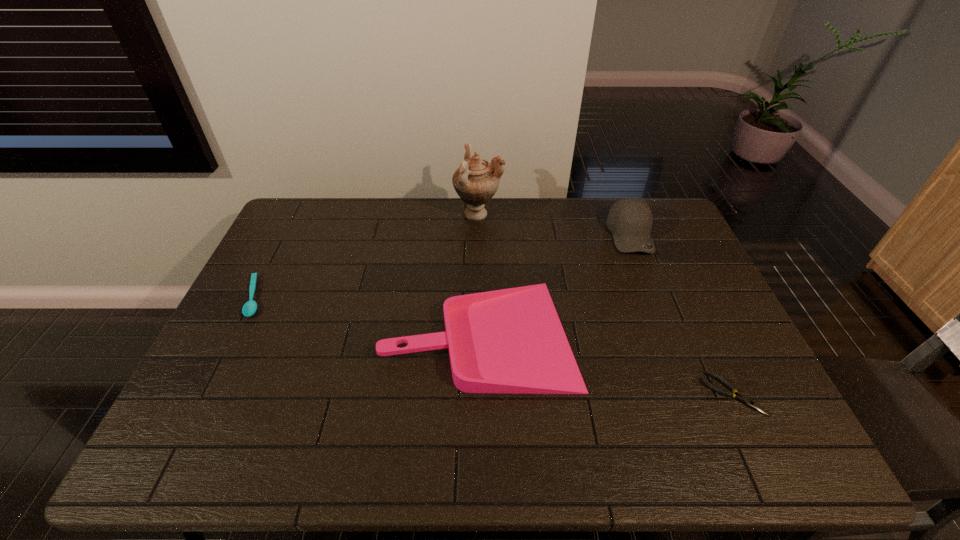
Locate an element on the screen. The height and width of the screenshot is (540, 960). the tallest object is located at coordinates (476, 181).

Where is `baseball cap`? This screenshot has height=540, width=960. baseball cap is located at coordinates (630, 220).

Locate an element on the screen. Image resolution: width=960 pixels, height=540 pixels. the third shortest object is located at coordinates (505, 341).

Identify the location of spoon. The height and width of the screenshot is (540, 960). (250, 307).

I want to click on pliers, so click(x=741, y=398).

At what (x,y) coordinates should I click in order to perform the action: click on free space located on the left of the tallest object. Please return your answer as a coordinate pair (x, y). This screenshot has width=960, height=540. Looking at the image, I should click on (429, 214).

Locate an element on the screen. Image resolution: width=960 pixels, height=540 pixels. vacant space located on the front brim of the baseball cap is located at coordinates (660, 306).

Find the location of a particular element. vacant space located on the handle side of the third shortest object is located at coordinates (310, 333).

Where is `vacant space positioned 0.260m on the handle side of the third shortest object`? vacant space positioned 0.260m on the handle side of the third shortest object is located at coordinates (288, 333).

I want to click on free spot located on the handle side of the third shortest object, so click(x=310, y=333).